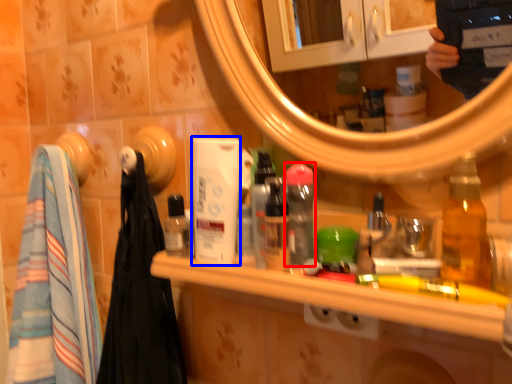
Question: Among these objects, which one is nearest to the camera, mouthwash (highlighted by a red box) or mouthwash (highlighted by a blue box)?

Choices:
 (A) mouthwash
 (B) mouthwash

Answer: (A)